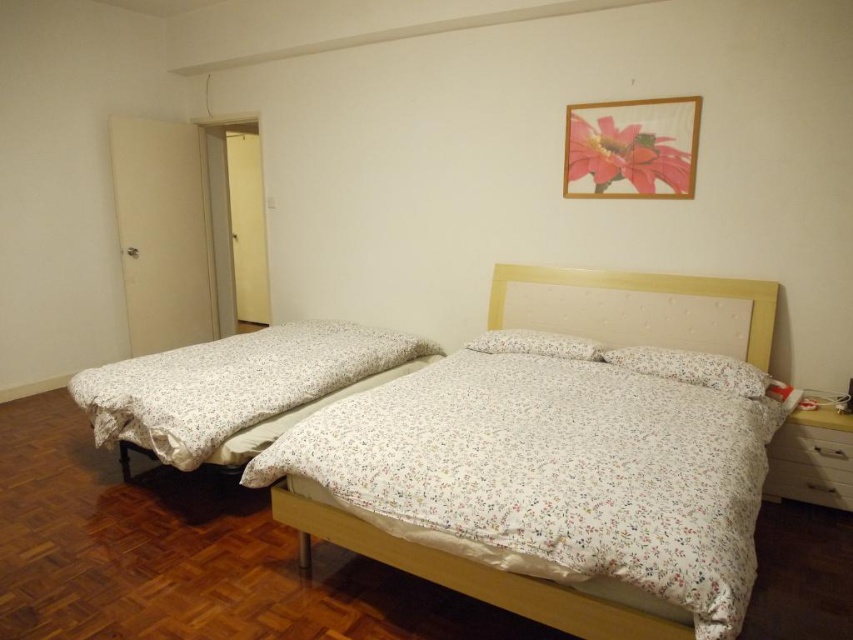
You are standing at the entrance of the bedroom and want to place a new lamp on the white floral fabric bed at center. According to the coordinates provided, where exactly should you place the lamp?

The white floral fabric bed at center is located at coordinates point [468,573], so you should place the lamp there.

You are a delivery person who just arrived at the bedroom. You need to place a large package on the floor. The package is too heavy to lift high. Which object between the white floral fabric bed at center and the white matte drawer at lower right should you place it near to avoid having to lift it too high?

You should place the large package near the white matte drawer at lower right because the white floral fabric bed at center is much taller, making it harder to reach without lifting the package higher.

You are standing in the bedroom and want to determine which of the two points, point (297, 522) or point (761, 392), is closer to you. Based on the description, which point is nearer?

Point (297, 522) is closer to the camera than point (761, 392), so it is the nearer point.